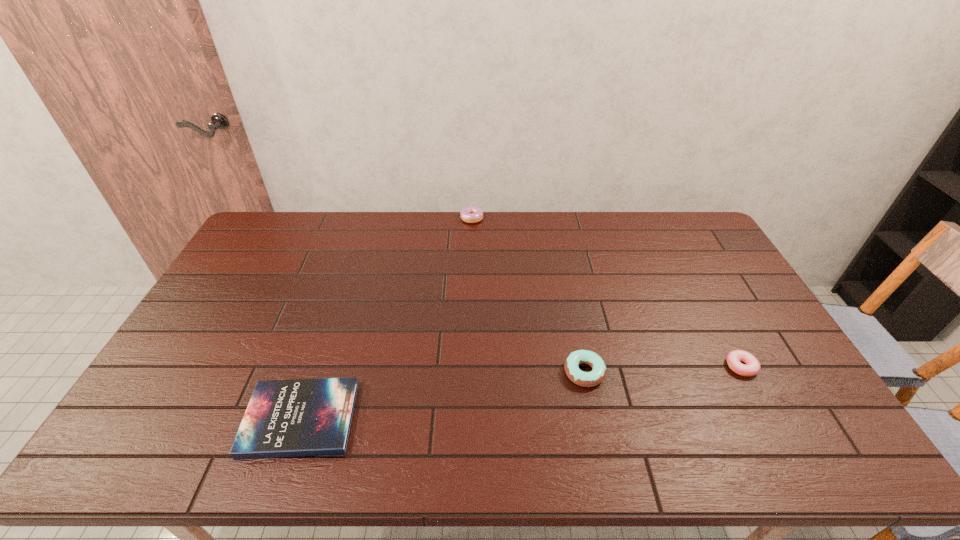
Where is `free space located 0.100m on the right of the hardback book`? free space located 0.100m on the right of the hardback book is located at coordinates [394, 418].

You are a GUI agent. You are given a task and a screenshot of the screen. Output one action in this format:
    pyautogui.click(x=<x>, y=<y>)
    Task: Click on the object at the far edge
    The width and height of the screenshot is (960, 540).
    Given the screenshot: What is the action you would take?
    pyautogui.click(x=471, y=214)

Locate an element on the screen. Image resolution: width=960 pixels, height=540 pixels. object at the near edge is located at coordinates (301, 417).

Locate an element on the screen. object located at the right edge is located at coordinates (752, 367).

This screenshot has width=960, height=540. In the image, there is a desktop. Find the location of `blank space at the far edge`. blank space at the far edge is located at coordinates (354, 218).

In the image, there is a desktop. Where is `vacant space at the near edge`? The height and width of the screenshot is (540, 960). vacant space at the near edge is located at coordinates (471, 447).

Locate an element on the screen. The height and width of the screenshot is (540, 960). vacant space at the left edge is located at coordinates (236, 294).

This screenshot has width=960, height=540. I want to click on unoccupied area between the hardback book and the farthest object, so click(386, 318).

At what (x,y) coordinates should I click in order to perform the action: click on vacant point located between the rightmost doughnut and the third object from left to right. Please return your answer as a coordinate pair (x, y). This screenshot has width=960, height=540. Looking at the image, I should click on (662, 369).

Image resolution: width=960 pixels, height=540 pixels. I want to click on vacant area between the third object from left to right and the hardback book, so click(x=443, y=395).